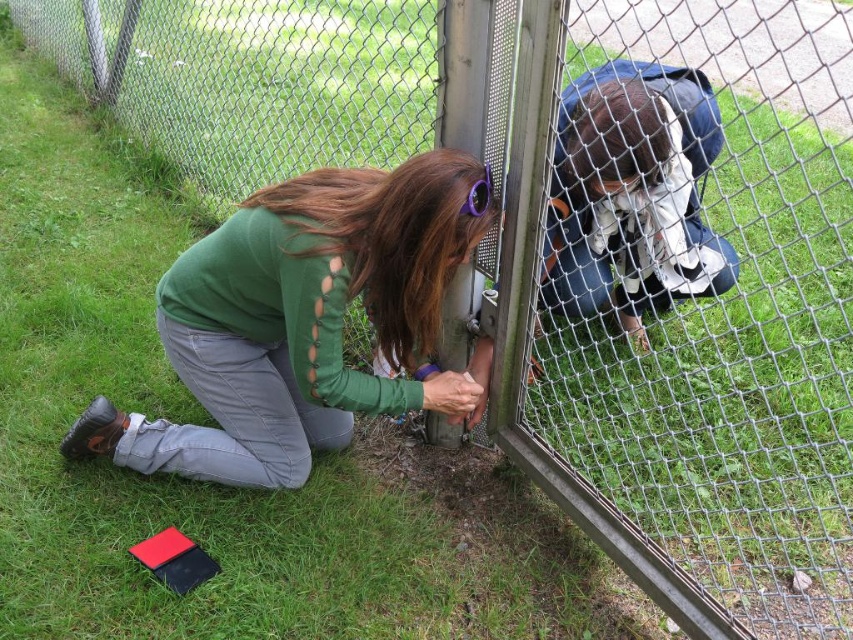
You are a safety inspector observing the scene. You notice the denim jacket at upper center and the purple plastic goggles at center. According to safety protocols, protective eyewear must be worn at all times. Is the worker complying with this requirement?

The purple plastic goggles at center are present, but the denim jacket at upper center has a greater height compared to them, which might indicate the goggles are not positioned correctly on the worker. Therefore, the worker is not fully complying with safety protocols as the goggles may not be properly worn.

You are a delivery robot with a 1.5 meter wide package. You need to pass between the two people to reach the delivery point behind them. Can you fit through the space between the green matte shirt at lower left and the other person?

The two people are 1.63 meters apart, so the delivery robot with a 1.5 meter wide package can fit through the space between the green matte shirt at lower left and the other person since the gap is wider than the package.